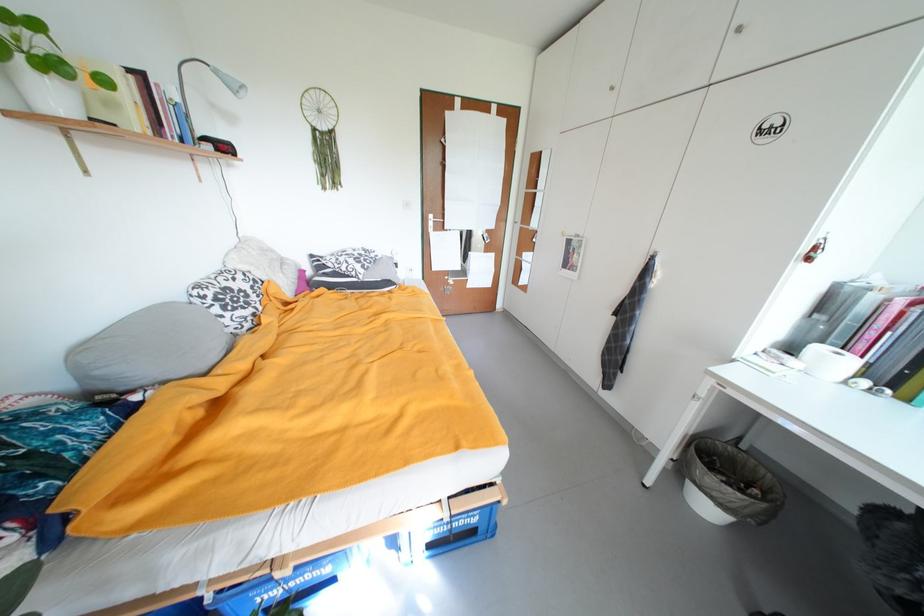
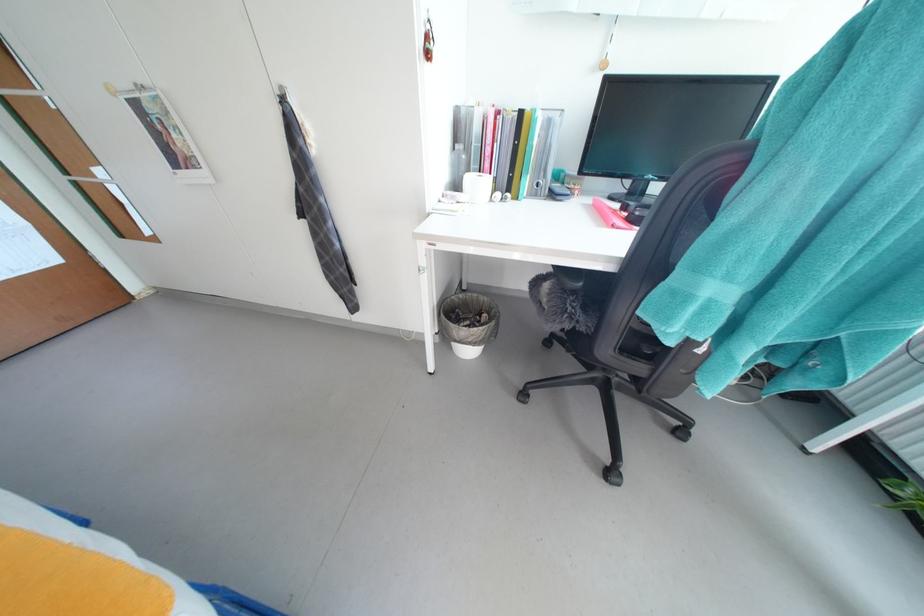
Locate, in the second image, the point that corresponds to (811,251) in the first image.

(428, 41)